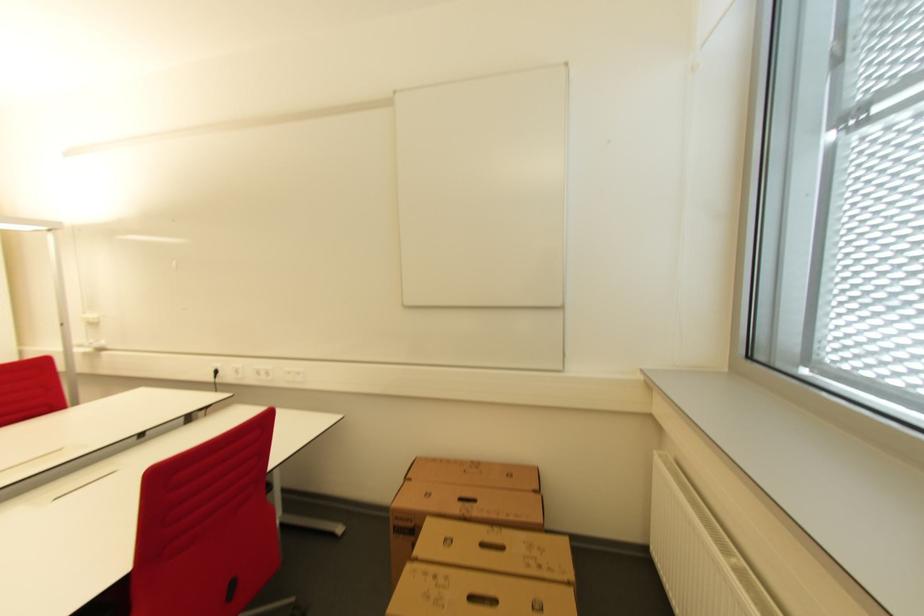
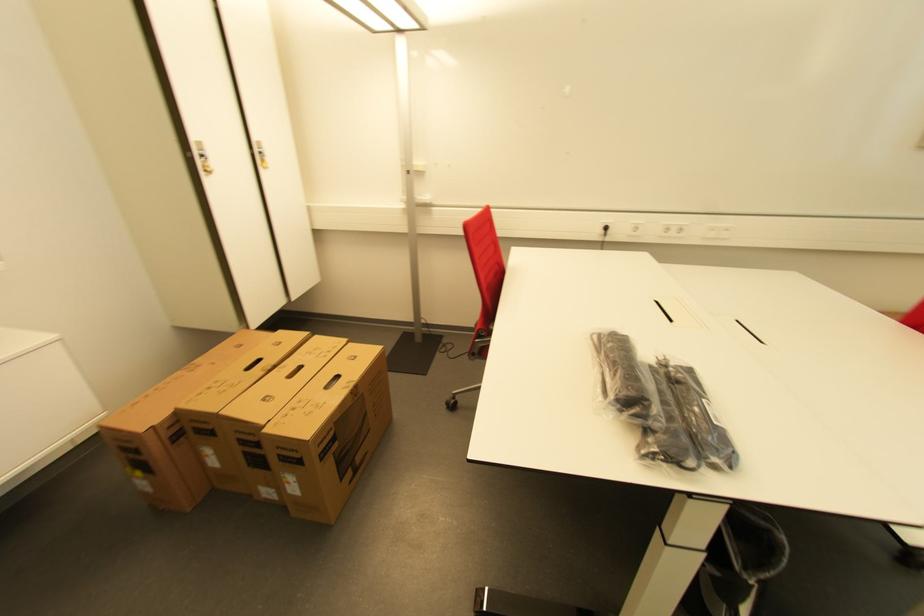
Question: Which direction would the cameraman need to move to produce the second image? Reply with the corresponding letter.

Choices:
 (A) Left
 (B) Right
 (C) Forward
 (D) Backward

Answer: (A)